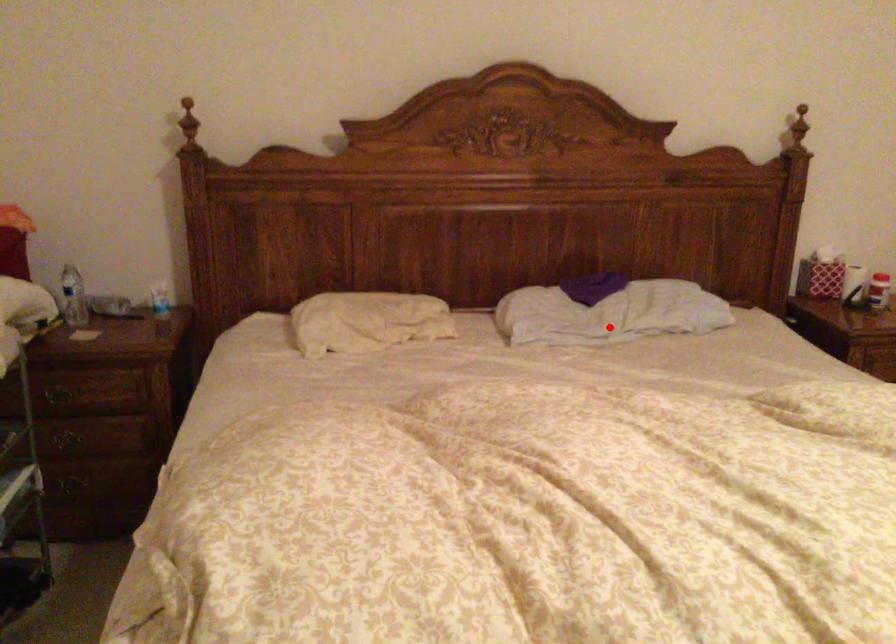
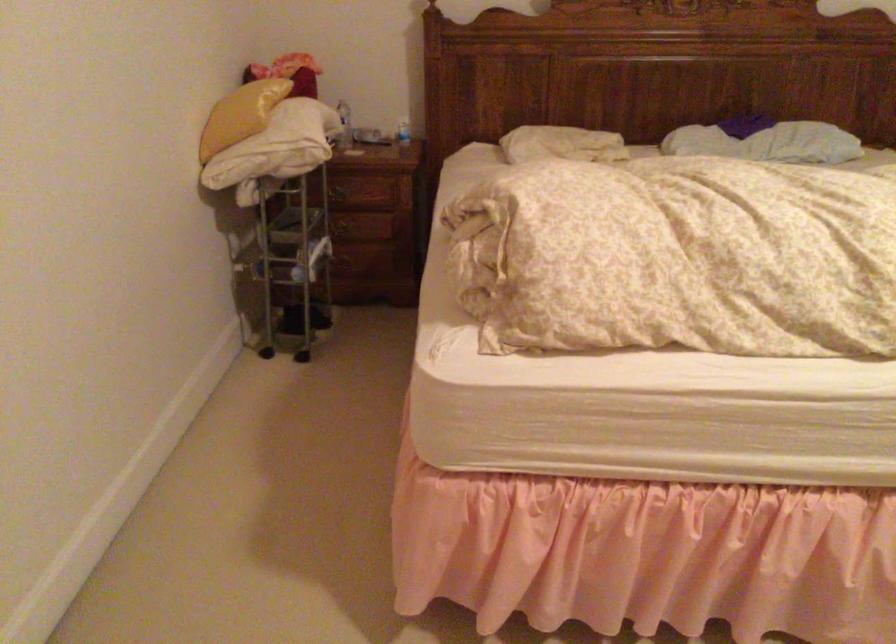
Question: I am providing you with two images of the same scene from different viewpoints. A red point is marked on the first image. Can you still see the location of the red point in image 2?

Choices:
 (A) Yes
 (B) No

Answer: (A)